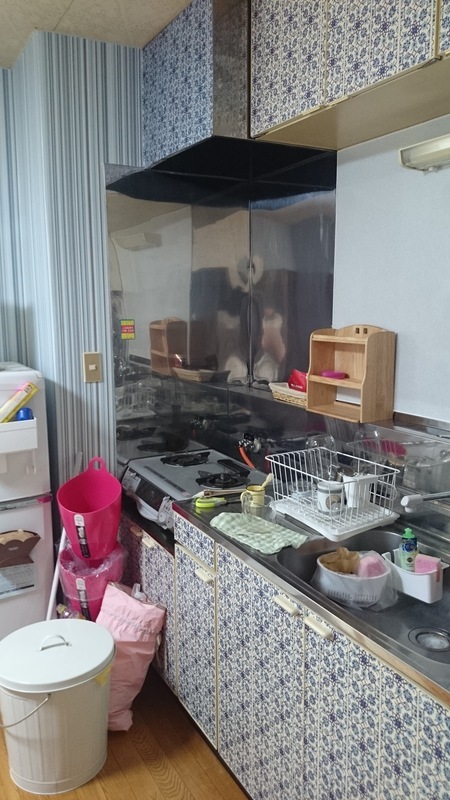
You are a GUI agent. You are given a task and a screenshot of the screen. Output one action in this format:
    pyautogui.click(x=<x>, y=<y>)
    Task: Click on the space under top cabinet
    
    Given the screenshot: What is the action you would take?
    click(x=368, y=118)